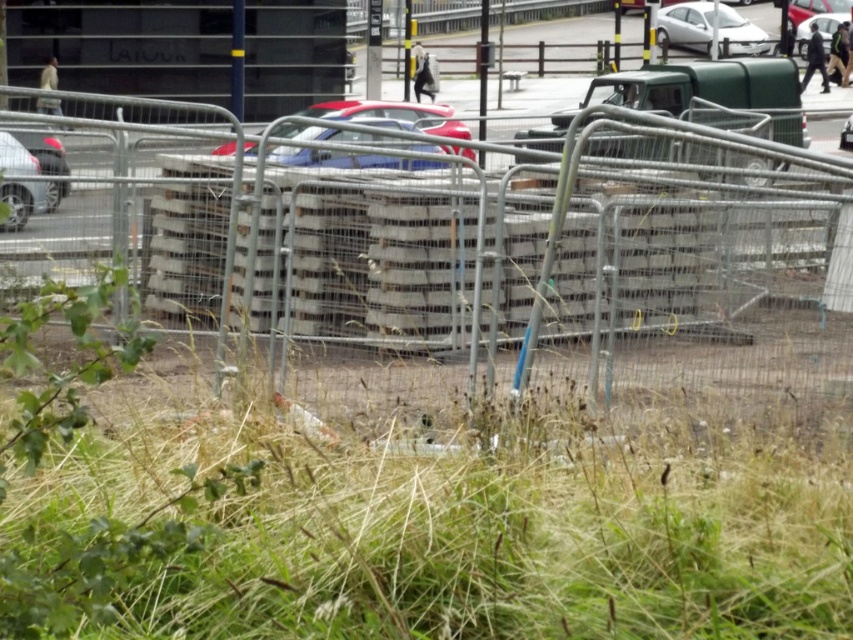
Question: Which of the following is the closest to the observer?

Choices:
 (A) (440, 124)
 (B) (79, 292)
 (C) (807, 33)
 (D) (695, 20)

Answer: (B)

Question: Does green leafy weed at lower left appear over shiny red car at center?

Choices:
 (A) no
 (B) yes

Answer: (A)

Question: Among these objects, which one is farthest from the camera?

Choices:
 (A) shiny red car at center
 (B) white glossy car at upper center
 (C) metallic blue sedan at center

Answer: (B)

Question: Which object is positioned closest to the green leafy weed at lower left?

Choices:
 (A) shiny metallic car at left
 (B) shiny red car at center
 (C) metallic blue sedan at center
 (D) white glossy car at upper center

Answer: (A)

Question: Can you confirm if shiny red car at center is positioned to the left of shiny metallic car at left?

Choices:
 (A) yes
 (B) no

Answer: (B)

Question: Does green leafy weed at lower left appear under shiny red car at center?

Choices:
 (A) no
 (B) yes

Answer: (B)